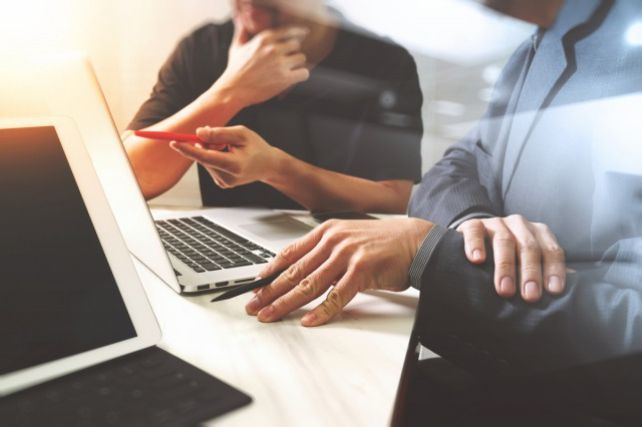
Image resolution: width=642 pixels, height=427 pixels. What are the coordinates of `table` in the screenshot? It's located at (321, 372).